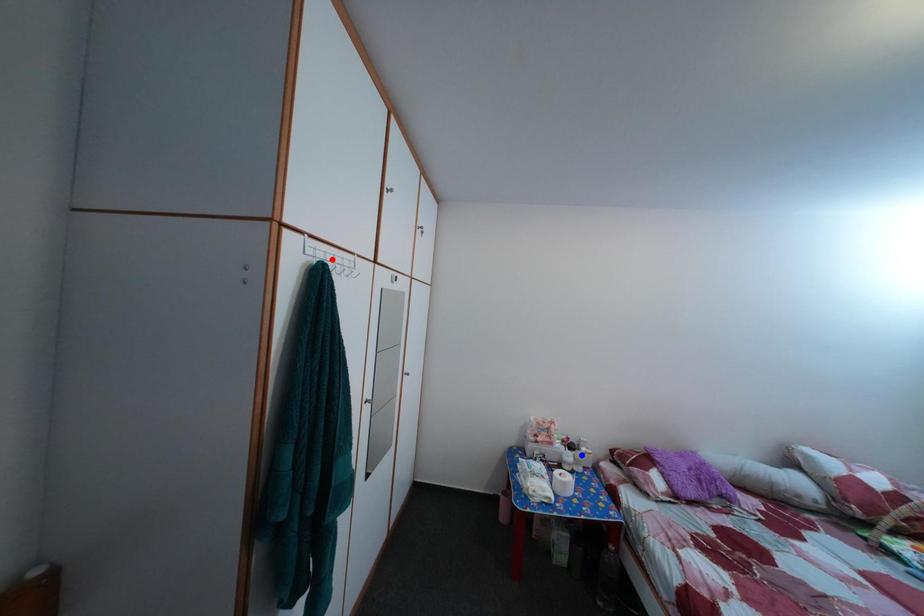
Question: Two points are marked on the image. Which point is closer to the camera?

Choices:
 (A) Blue point is closer.
 (B) Red point is closer.

Answer: (B)